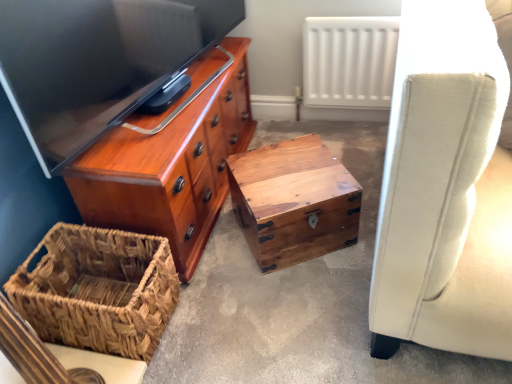
Question: From the image's perspective, is wooden chest at center on woven brown picnic basket at lower left?

Choices:
 (A) no
 (B) yes

Answer: (B)

Question: Is wooden chest at center taller than woven brown picnic basket at lower left?

Choices:
 (A) yes
 (B) no

Answer: (B)

Question: Would you consider wooden chest at center to be distant from woven brown picnic basket at lower left?

Choices:
 (A) yes
 (B) no

Answer: (B)

Question: Is wooden chest at center surrounding woven brown picnic basket at lower left?

Choices:
 (A) yes
 (B) no

Answer: (B)

Question: From the image's perspective, does wooden chest at center appear lower than woven brown picnic basket at lower left?

Choices:
 (A) yes
 (B) no

Answer: (B)

Question: From a real-world perspective, relative to wooden chest at center, is white matte radiator at upper center vertically above or below?

Choices:
 (A) below
 (B) above

Answer: (B)

Question: Is white matte radiator at upper center bigger or smaller than wooden chest at center?

Choices:
 (A) big
 (B) small

Answer: (B)

Question: From the image's perspective, is white matte radiator at upper center located above or below wooden chest at center?

Choices:
 (A) above
 (B) below

Answer: (A)

Question: Does point (345, 16) appear closer or farther from the camera than point (335, 354)?

Choices:
 (A) closer
 (B) farther

Answer: (B)

Question: Considering the positions of point (252, 142) and point (130, 140), is point (252, 142) closer or farther from the camera than point (130, 140)?

Choices:
 (A) farther
 (B) closer

Answer: (A)

Question: In terms of width, does wooden chest at center look wider or thinner when compared to shiny wood chest of drawers at upper left?

Choices:
 (A) thin
 (B) wide

Answer: (B)

Question: Is wooden chest at center spatially inside shiny wood chest of drawers at upper left, or outside of it?

Choices:
 (A) outside
 (B) inside

Answer: (A)

Question: Looking at the image, does wooden chest at center seem bigger or smaller compared to shiny wood chest of drawers at upper left?

Choices:
 (A) small
 (B) big

Answer: (A)

Question: Based on their sizes in the image, would you say wooden chest at center is bigger or smaller than natural wood trunk at center?

Choices:
 (A) big
 (B) small

Answer: (A)

Question: Would you say wooden chest at center is to the left or to the right of natural wood trunk at center in the picture?

Choices:
 (A) right
 (B) left

Answer: (B)